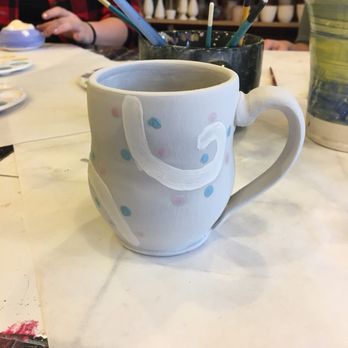
The height and width of the screenshot is (348, 348). What are the coordinates of `coffee cup` in the screenshot? It's located at (160, 154).